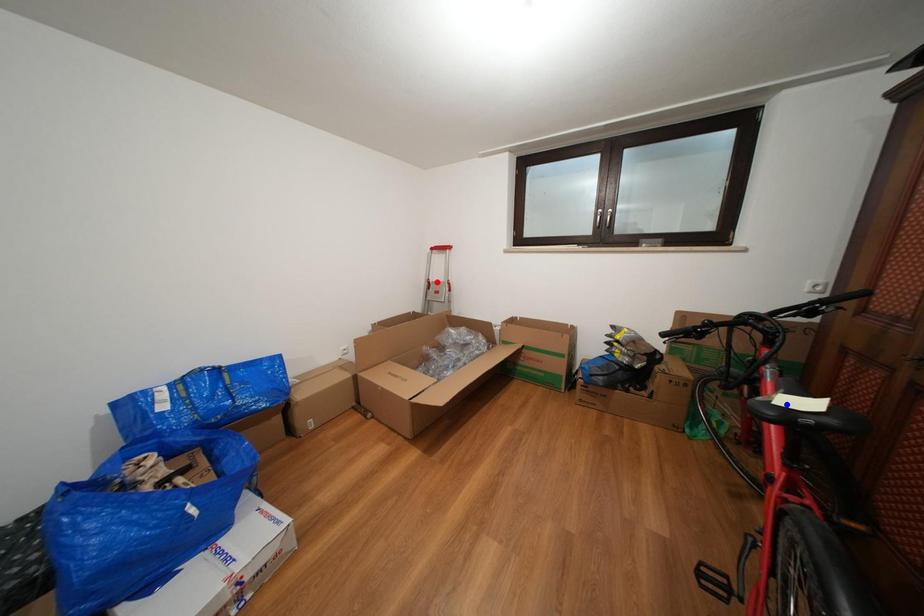
Question: Two points are marked on the image. Which point is closer to the camera?

Choices:
 (A) Blue point is closer.
 (B) Red point is closer.

Answer: (A)